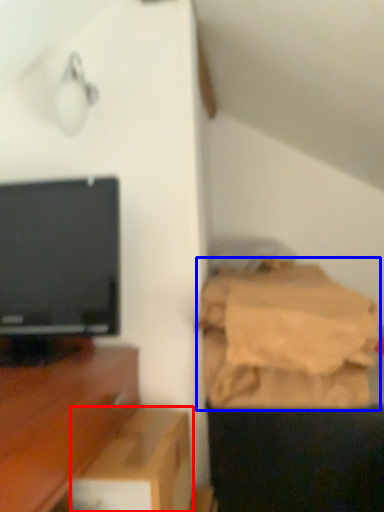
Question: Which of the following is the closest to the observer, cardboard box (highlighted by a red box) or sheet (highlighted by a blue box)?

Choices:
 (A) cardboard box
 (B) sheet

Answer: (A)